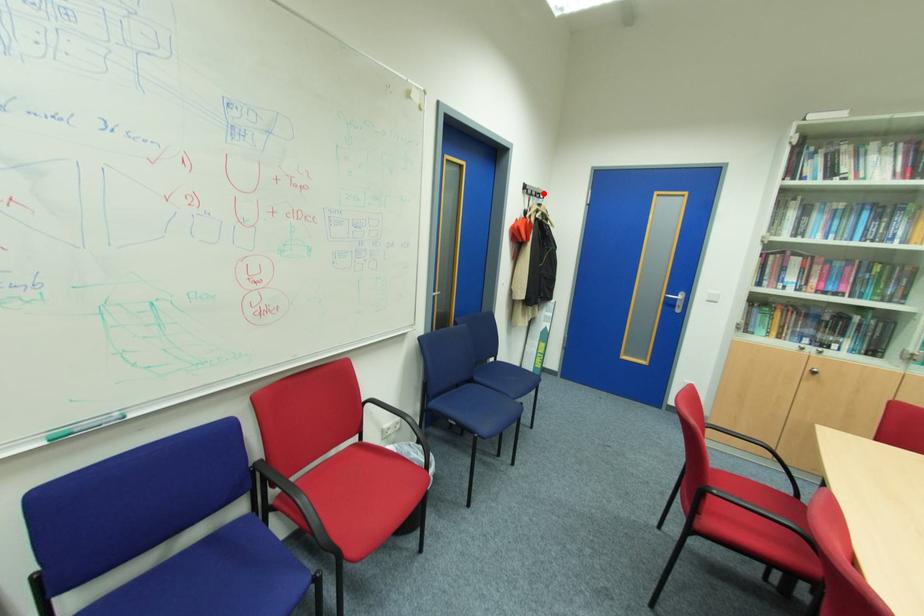
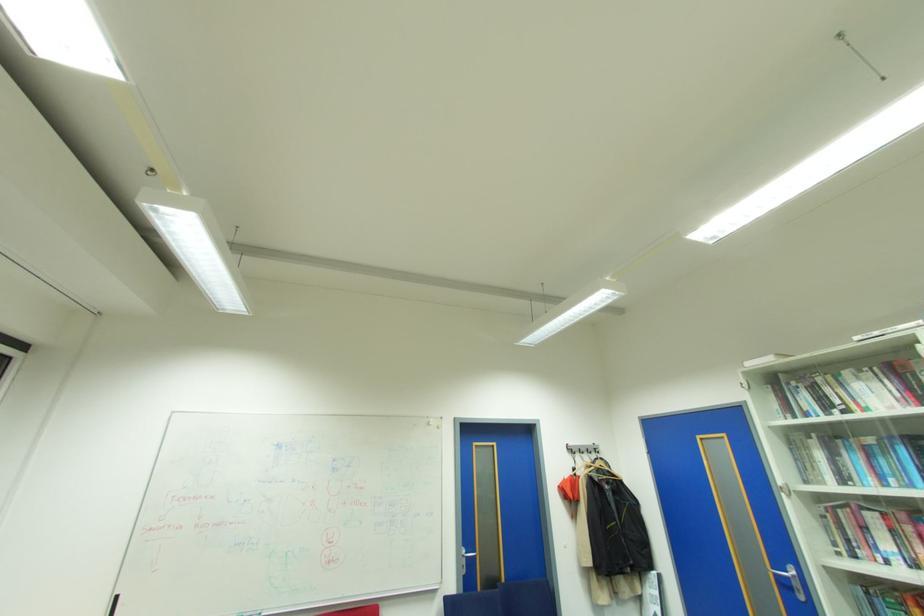
Question: I am providing you with two images of the same scene from different viewpoints. A red point is shown in image1. For the corresponding object point in image2, is it positioned nearer or farther from the camera?

Choices:
 (A) Nearer
 (B) Farther

Answer: (B)